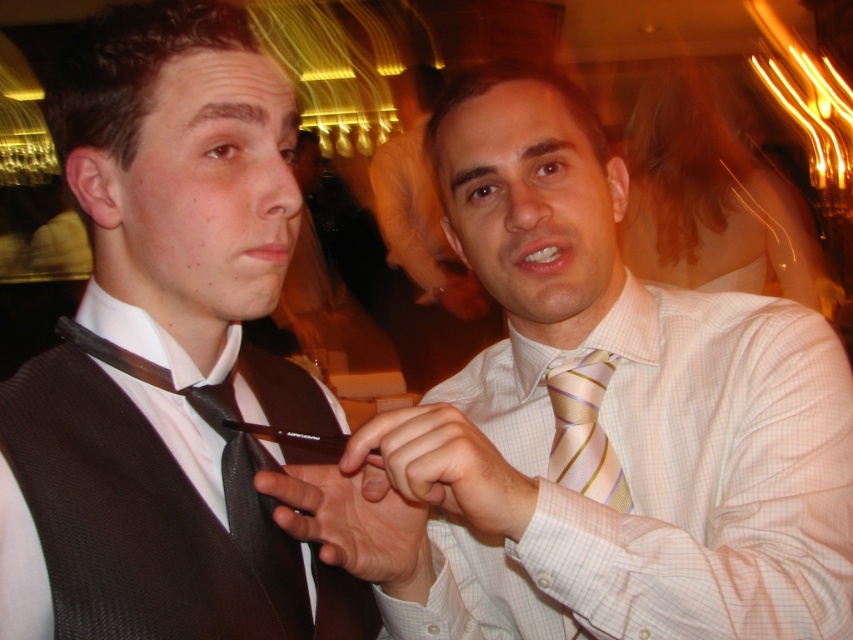
Is matte white shirt at center taller than pink striped tie at center?

Yes.

Identify the location of matte white shirt at center. The image size is (853, 640). (419, 204).

Between matte black tie at left and pink striped tie at center, which one has more height?

matte black tie at left

Who is shorter, matte black tie at left or pink striped tie at center?

pink striped tie at center

Which is behind, point (229, 252) or point (550, 372)?

Point (550, 372)

You are a GUI agent. You are given a task and a screenshot of the screen. Output one action in this format:
    pyautogui.click(x=<x>, y=<y>)
    Task: Click on the matte black tie at left
    
    Given the screenshot: What is the action you would take?
    pyautogui.click(x=165, y=353)

Who is taller, matte black tie at center or pink striped tie at center?

With more height is matte black tie at center.

Is matte black tie at center above pink striped tie at center?

Correct, matte black tie at center is located above pink striped tie at center.

Measure the distance between matte black tie at center and camera.

matte black tie at center is 21.87 inches from camera.

Image resolution: width=853 pixels, height=640 pixels. In order to click on matte black tie at center in this screenshot , I will do `click(596, 420)`.